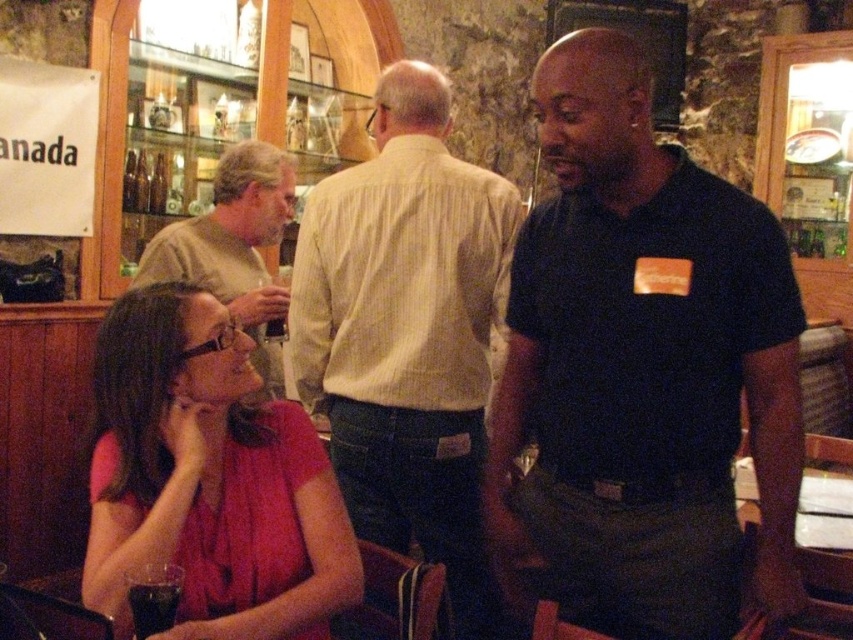
You are a bartender who needs to serve a customer. You see the light brown shirt at upper left and the dark brown liquid at lower left. Which object is taller? Please answer based on the scene description.

The light brown shirt at upper left is taller than the dark brown liquid at lower left according to the scene description.